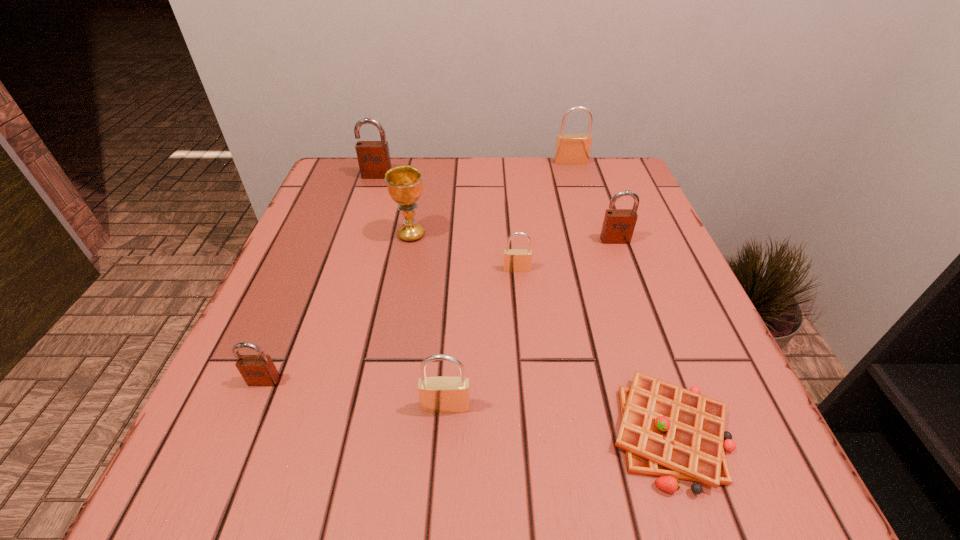
The width and height of the screenshot is (960, 540). Find the location of `the biggest brass padlock`. the biggest brass padlock is located at coordinates (571, 149).

Image resolution: width=960 pixels, height=540 pixels. Identify the location of the farthest brass padlock. pyautogui.click(x=571, y=149).

Identify the location of the second brown padlock from left to right. Image resolution: width=960 pixels, height=540 pixels. (373, 157).

Where is `the second padlock from left to right`? The height and width of the screenshot is (540, 960). the second padlock from left to right is located at coordinates (373, 157).

Identify the location of the sixth object from right to left. (404, 183).

The image size is (960, 540). In order to click on chalice in this screenshot , I will do `click(404, 183)`.

The image size is (960, 540). Find the location of `the rightmost brown padlock`. the rightmost brown padlock is located at coordinates (618, 226).

The width and height of the screenshot is (960, 540). In order to click on the fourth nearest padlock in this screenshot , I will do `click(618, 226)`.

The height and width of the screenshot is (540, 960). What are the coordinates of `the nearest padlock` in the screenshot? It's located at (436, 394).

At what (x,y) coordinates should I click in order to perform the action: click on the second smallest brass padlock. Please return your answer as a coordinate pair (x, y). Image resolution: width=960 pixels, height=540 pixels. Looking at the image, I should click on (436, 394).